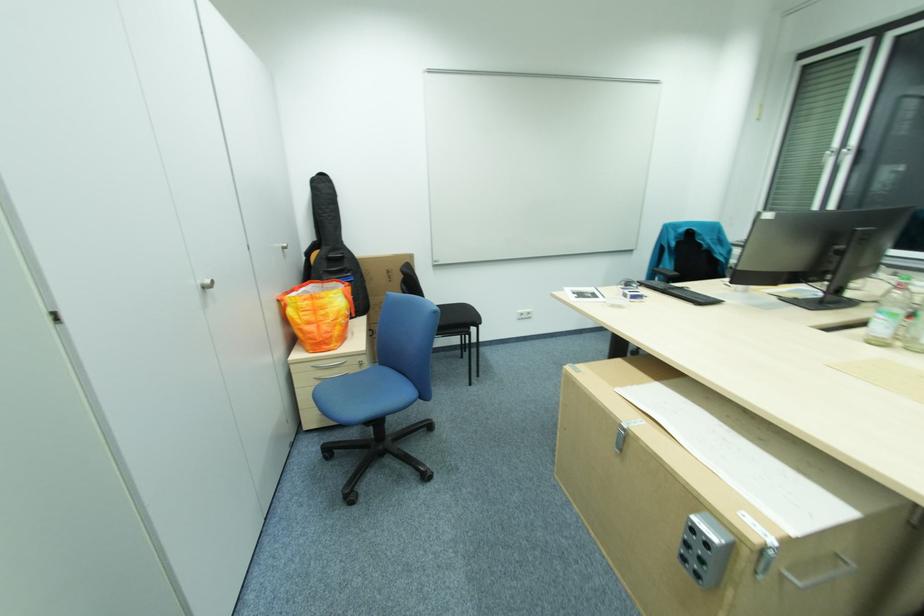
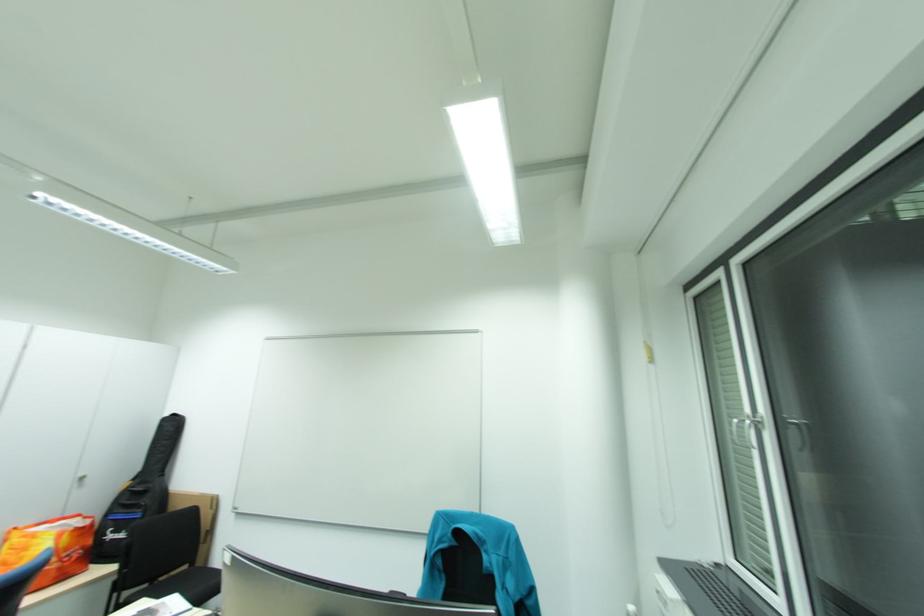
Locate, in the second image, the point that corresponds to pixel 356 273 in the first image.

(149, 508)